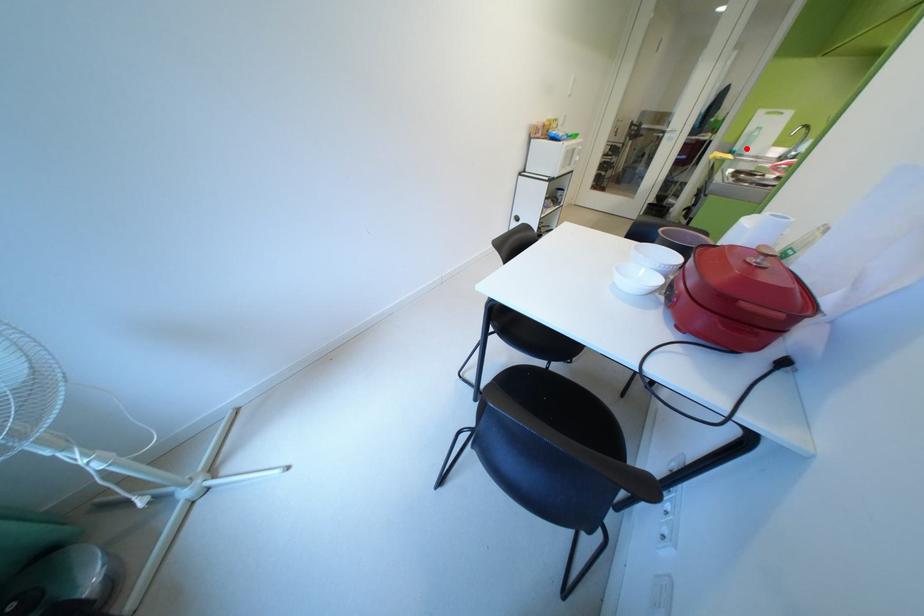
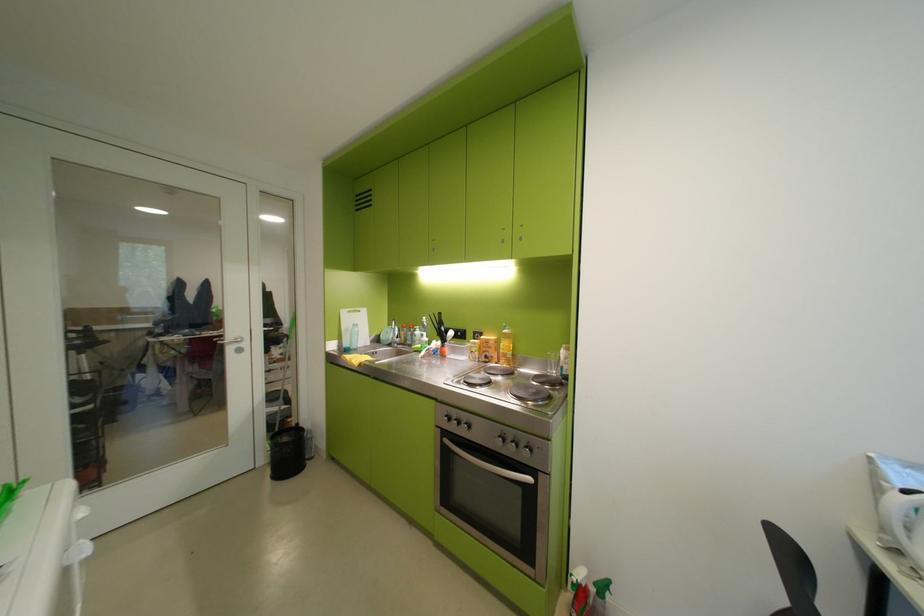
Locate, in the second image, the point that corresponds to the highlighted location in the first image.

(357, 345)